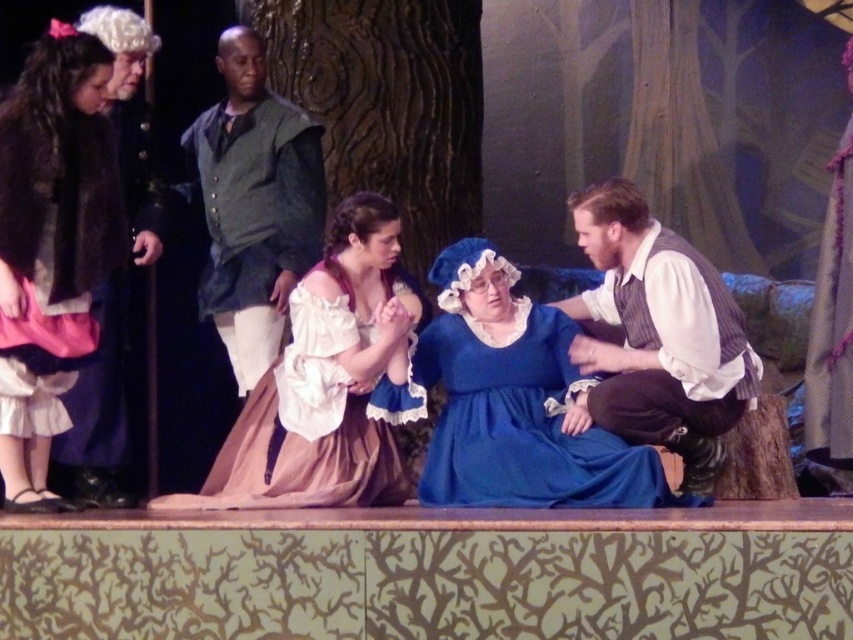
Does white lace dress at center have a larger size compared to dark green fabric shirt at upper center?

No, white lace dress at center is not bigger than dark green fabric shirt at upper center.

Is white lace dress at center taller than dark green fabric shirt at upper center?

No.

Is point (386, 301) behind point (260, 154)?

No.

You are a GUI agent. You are given a task and a screenshot of the screen. Output one action in this format:
    pyautogui.click(x=<x>, y=<y>)
    Task: Click on the white lace dress at center
    The image size is (853, 640).
    Given the screenshot: What is the action you would take?
    pyautogui.click(x=323, y=381)

Between blue satin dress at center and dark green fabric shirt at upper center, which one has less height?

With less height is blue satin dress at center.

Describe the element at coordinates (509, 401) in the screenshot. I see `blue satin dress at center` at that location.

The width and height of the screenshot is (853, 640). Identify the location of blue satin dress at center. (509, 401).

The height and width of the screenshot is (640, 853). I want to click on blue satin dress at center, so click(509, 401).

Is velvet black coat at left further to the viewer compared to white lace dress at center?

No, it is in front of white lace dress at center.

Does velvet black coat at left have a smaller size compared to white lace dress at center?

Correct, velvet black coat at left occupies less space than white lace dress at center.

Is point (6, 486) more distant than point (369, 250)?

No, it is in front of (369, 250).

Where is `velvet black coat at left`? Image resolution: width=853 pixels, height=640 pixels. velvet black coat at left is located at coordinates (51, 246).